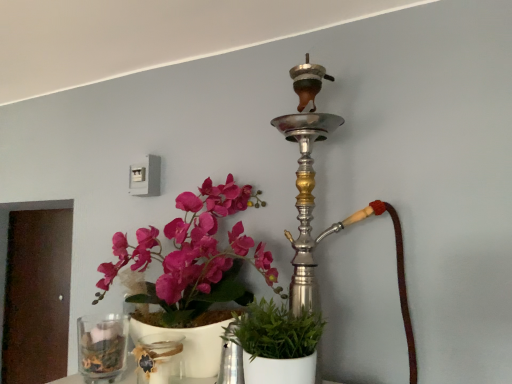
Question: Is silver metallic hookah at upper center taller than clear glass vase at lower left?

Choices:
 (A) yes
 (B) no

Answer: (A)

Question: From a real-world perspective, is silver metallic hookah at upper center positioned under clear glass vase at lower left based on gravity?

Choices:
 (A) yes
 (B) no

Answer: (B)

Question: Does silver metallic hookah at upper center lie behind clear glass vase at lower left?

Choices:
 (A) no
 (B) yes

Answer: (A)

Question: From the image's perspective, is silver metallic hookah at upper center located beneath clear glass vase at lower left?

Choices:
 (A) no
 (B) yes

Answer: (A)

Question: Considering the relative positions of silver metallic hookah at upper center and clear glass vase at lower left in the image provided, is silver metallic hookah at upper center to the left of clear glass vase at lower left from the viewer's perspective?

Choices:
 (A) yes
 (B) no

Answer: (B)

Question: Is transparent glass jar at lower center in front of or behind clear glass vase at lower left in the image?

Choices:
 (A) behind
 (B) front

Answer: (B)

Question: Would you say transparent glass jar at lower center is to the left or to the right of clear glass vase at lower left in the picture?

Choices:
 (A) right
 (B) left

Answer: (A)

Question: Considering the positions of point (137, 380) and point (79, 364), is point (137, 380) closer or farther from the camera than point (79, 364)?

Choices:
 (A) farther
 (B) closer

Answer: (B)

Question: Is transparent glass jar at lower center inside the boundaries of clear glass vase at lower left, or outside?

Choices:
 (A) outside
 (B) inside

Answer: (A)

Question: From the image's perspective, is green matte plant at center positioned above or below transparent glass jar at lower center?

Choices:
 (A) above
 (B) below

Answer: (A)

Question: In the image, is green matte plant at center positioned in front of or behind transparent glass jar at lower center?

Choices:
 (A) front
 (B) behind

Answer: (A)

Question: From a real-world perspective, is green matte plant at center positioned above or below transparent glass jar at lower center?

Choices:
 (A) above
 (B) below

Answer: (A)

Question: Considering the positions of green matte plant at center and transparent glass jar at lower center in the image, is green matte plant at center wider or thinner than transparent glass jar at lower center?

Choices:
 (A) thin
 (B) wide

Answer: (B)

Question: Is clear glass vase at lower left wider or thinner than green matte plant at center?

Choices:
 (A) thin
 (B) wide

Answer: (A)

Question: Is point (114, 314) positioned closer to the camera than point (269, 299)?

Choices:
 (A) closer
 (B) farther

Answer: (B)